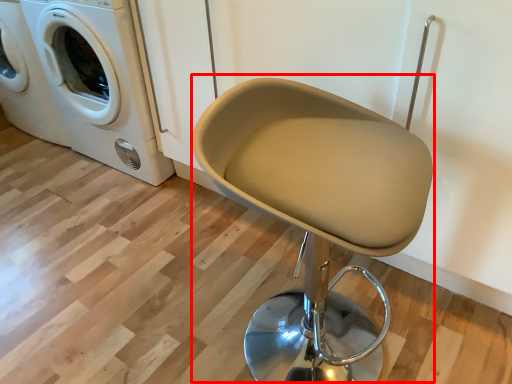
Question: From the image's perspective, considering the relative positions of swivel chair (annotated by the red box) and washing machine in the image provided, where is swivel chair (annotated by the red box) located with respect to the staircase?

Choices:
 (A) below
 (B) above

Answer: (A)